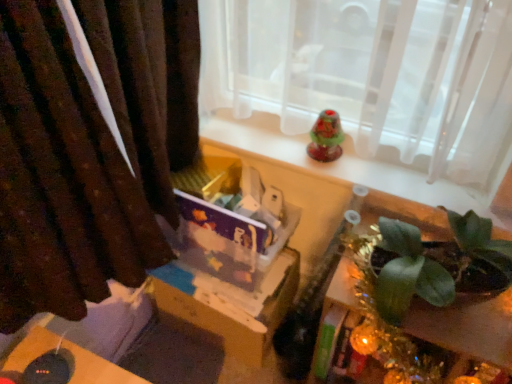
Question: From the image's perspective, does translucent glass bell at upper center appear lower than green leafy plant at lower right?

Choices:
 (A) yes
 (B) no

Answer: (B)

Question: Is translucent glass bell at upper center not close to green leafy plant at lower right?

Choices:
 (A) no
 (B) yes

Answer: (A)

Question: Considering the relative positions of translucent glass bell at upper center and green leafy plant at lower right in the image provided, is translucent glass bell at upper center to the left of green leafy plant at lower right from the viewer's perspective?

Choices:
 (A) no
 (B) yes

Answer: (B)

Question: From the image's perspective, is translucent glass bell at upper center above green leafy plant at lower right?

Choices:
 (A) yes
 (B) no

Answer: (A)

Question: Could you tell me if translucent glass bell at upper center is facing green leafy plant at lower right?

Choices:
 (A) yes
 (B) no

Answer: (B)

Question: From a real-world perspective, does translucent glass bell at upper center stand above green leafy plant at lower right?

Choices:
 (A) no
 (B) yes

Answer: (B)

Question: Is the position of brown velvet curtain at left less distant than that of translucent glass bell at upper center?

Choices:
 (A) no
 (B) yes

Answer: (B)

Question: Is brown velvet curtain at left shorter than translucent glass bell at upper center?

Choices:
 (A) yes
 (B) no

Answer: (B)

Question: Is there a large distance between brown velvet curtain at left and translucent glass bell at upper center?

Choices:
 (A) yes
 (B) no

Answer: (B)

Question: From the image's perspective, does brown velvet curtain at left appear lower than translucent glass bell at upper center?

Choices:
 (A) no
 (B) yes

Answer: (B)

Question: From the image's perspective, would you say brown velvet curtain at left is positioned over translucent glass bell at upper center?

Choices:
 (A) yes
 (B) no

Answer: (B)

Question: Can you confirm if brown velvet curtain at left is thinner than translucent glass bell at upper center?

Choices:
 (A) no
 (B) yes

Answer: (A)

Question: Are translucent glass bell at upper center and brown velvet curtain at left far apart?

Choices:
 (A) yes
 (B) no

Answer: (B)